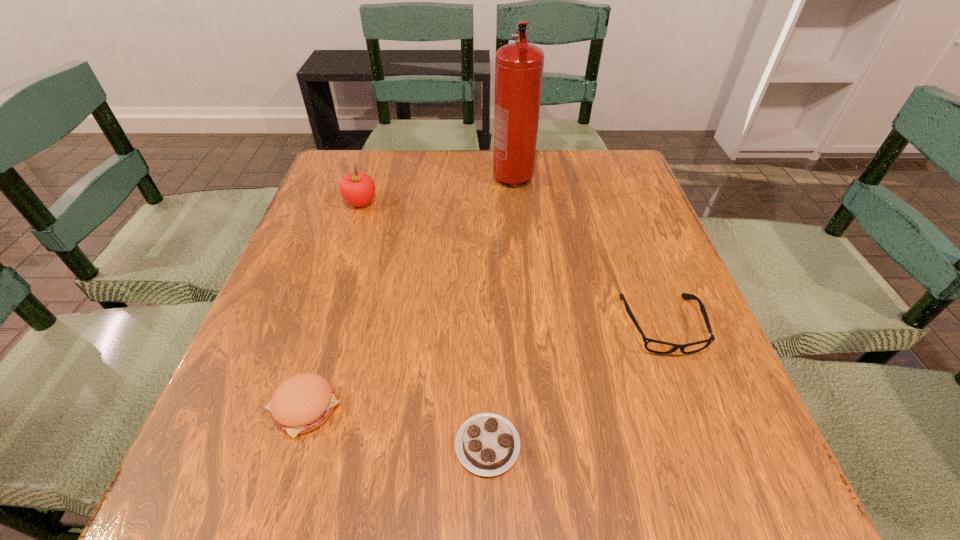
Locate an element on the screen. This screenshot has height=540, width=960. the tallest object is located at coordinates (519, 66).

Find the location of a particular element. the fourth shortest object is located at coordinates click(358, 189).

Identify the location of patty. The image size is (960, 540). (303, 402).

At what (x,y) coordinates should I click in order to perform the action: click on the third farthest object. Please return your answer as a coordinate pair (x, y). Looking at the image, I should click on (655, 346).

Where is `the rightmost object`? the rightmost object is located at coordinates (655, 346).

This screenshot has height=540, width=960. Identify the location of the shortest object. (487, 444).

The height and width of the screenshot is (540, 960). Identify the location of free space located on the handle side the tallest object. (524, 301).

Find the location of `free location located on the back of the second tallest object`. free location located on the back of the second tallest object is located at coordinates (370, 174).

You are a GUI agent. You are given a task and a screenshot of the screen. Output one action in this format:
    pyautogui.click(x=<x>, y=<y>)
    Task: Click on the vacant space located 0.180m on the back of the patty
    
    Given the screenshot: What is the action you would take?
    pyautogui.click(x=338, y=300)

The height and width of the screenshot is (540, 960). What are the coordinates of `vacant region located 0.150m on the front-facing side of the third farthest object` in the screenshot? It's located at (705, 441).